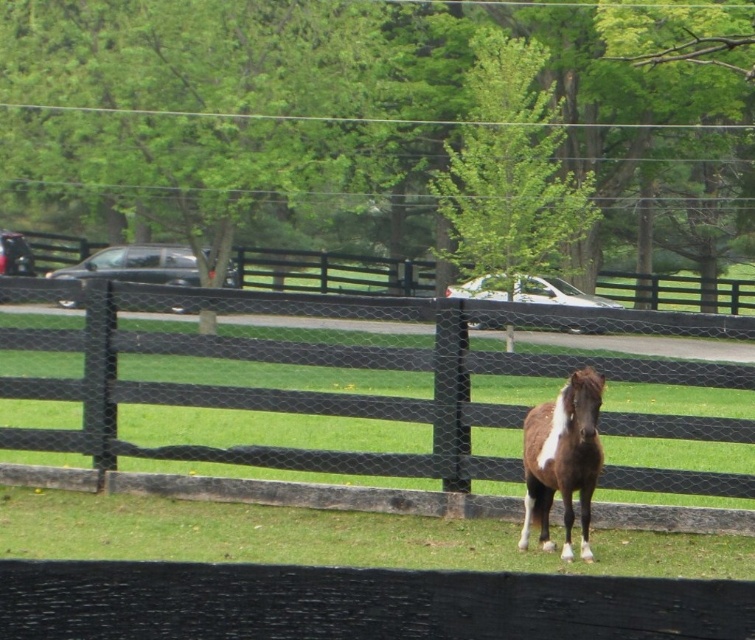
You are a photographer trying to capture the entire scene of the brown glossy horse at center and the green grass at lower center in one shot. Which object should you focus on first to ensure both are in frame?

The green grass at lower center is larger in size than the brown glossy horse at center, so you should focus on the green grass at lower center first to ensure both fit within the frame.